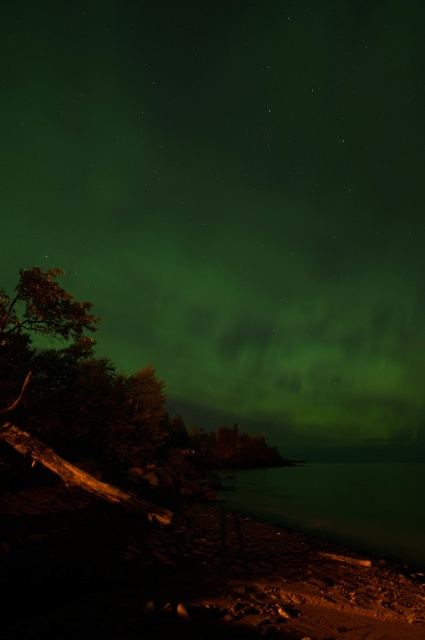
You are standing at the point marked as point (73,378) in the image. Looking around, you see the green leafy tree at left. Which direction should you face to see the Northern Lights in the sky?

You should face away from the green leafy tree at left because the Northern Lights are in the sky opposite to it.

You are standing on the rocky shoreline and want to take a photo of the green leafy tree at left and the green translucent water at lower center. Which object will appear closer to the camera in the photo?

The green leafy tree at left will appear closer to the camera in the photo because it is in front of the green translucent water at lower center.

You are an astronomer observing the Northern Lights and notice the green leafy tree at left and the green translucent water at lower center in the image. Which object is positioned higher relative to the other?

The green leafy tree at left is above the green translucent water at lower center, so it is positioned higher.